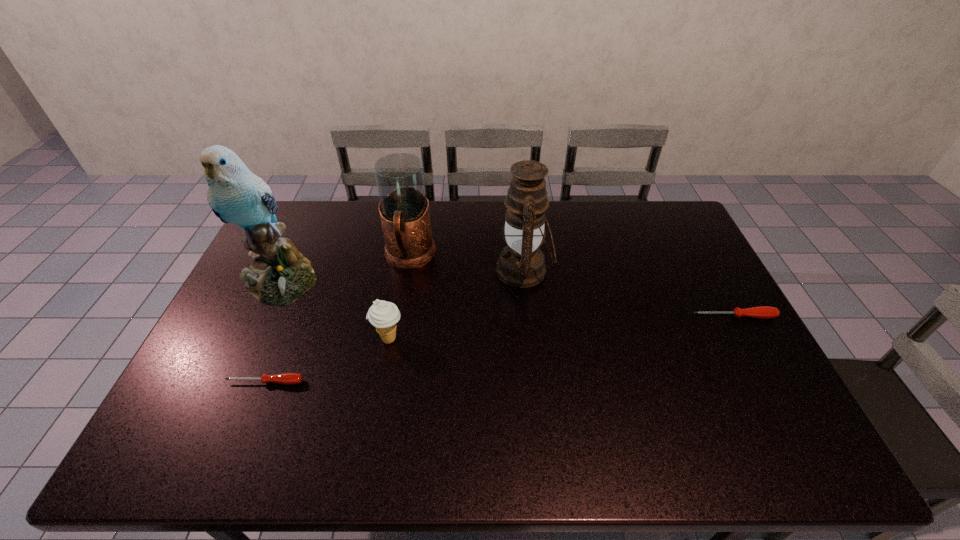
Locate an element on the screen. object that is the fifth closest to the pitcher is located at coordinates (762, 312).

Find the location of a particular element. vacant space that satisfies the following two spatial constraints: 1. on the front side of the right screwdriver; 2. on the left side of the fifth object from left to right is located at coordinates (529, 317).

This screenshot has height=540, width=960. I want to click on vacant region that satisfies the following two spatial constraints: 1. on the face of the fifth farthest object; 2. on the right side of the tallest object, so click(253, 339).

Identify the location of vacant space that satisfies the following two spatial constraints: 1. on the face of the tallest object; 2. on the right side of the shortest object. (233, 382).

Find the location of a particular element. vacant area that satisfies the following two spatial constraints: 1. on the face of the tallest object; 2. on the left side of the rightmost object is located at coordinates (263, 317).

Locate an element on the screen. This screenshot has height=540, width=960. vacant region that satisfies the following two spatial constraints: 1. with the handle on the side of the farther screwdriver; 2. on the left side of the fourth shortest object is located at coordinates [399, 317].

The width and height of the screenshot is (960, 540). Find the location of `free spot that satisfies the following two spatial constraints: 1. with the handle on the side of the fifth object from left to right; 2. on the right side of the fourth shortest object`. free spot that satisfies the following two spatial constraints: 1. with the handle on the side of the fifth object from left to right; 2. on the right side of the fourth shortest object is located at coordinates pos(407,270).

The image size is (960, 540). I want to click on vacant area in the image that satisfies the following two spatial constraints: 1. with the handle on the side of the oil lamp; 2. on the right side of the third tallest object, so click(407, 270).